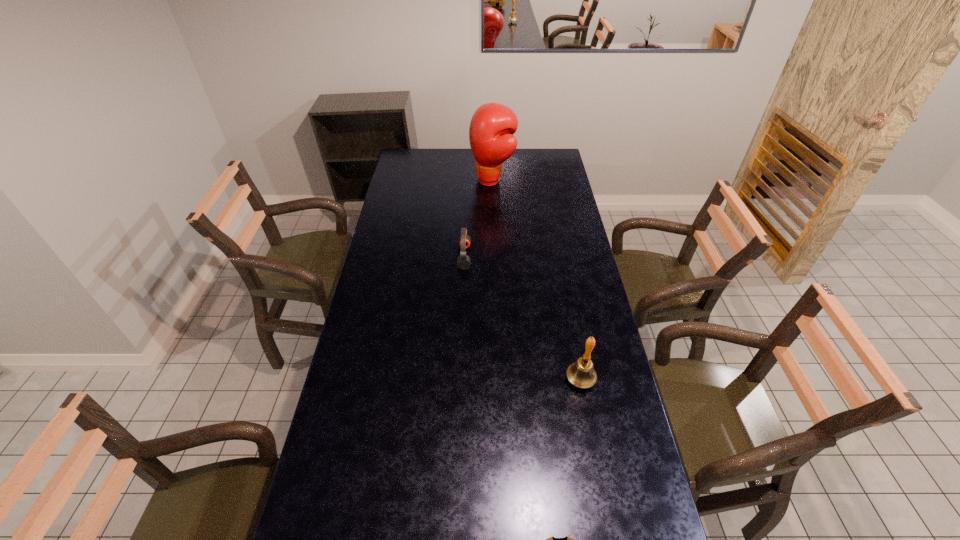
The height and width of the screenshot is (540, 960). I want to click on free space located on the ear cups of the earphone, so click(553, 257).

You are a GUI agent. You are given a task and a screenshot of the screen. Output one action in this format:
    pyautogui.click(x=<x>, y=<y>)
    Task: Click on the object located in the far edge section of the desktop
    This screenshot has width=960, height=540.
    Given the screenshot: What is the action you would take?
    pyautogui.click(x=492, y=126)

What are the coordinates of `object situated at the right edge` in the screenshot? It's located at (581, 374).

Where is `free space at the far edge of the desktop`? This screenshot has width=960, height=540. free space at the far edge of the desktop is located at coordinates (507, 164).

Find the location of a particular element. vacant space at the left edge of the desktop is located at coordinates (406, 215).

Find the location of a particular element. The height and width of the screenshot is (540, 960). vacant area at the right edge of the desktop is located at coordinates pos(636,494).

What are the coordinates of `vacant position at the far left corner of the desktop` in the screenshot? It's located at coord(417,164).

In order to click on free area in between the boxing glove and the earphone in this screenshot , I will do `click(478, 219)`.

At what (x,y) coordinates should I click in order to perform the action: click on vacant space that's between the tallest object and the second tallest object. Please return your answer as a coordinate pair (x, y). This screenshot has height=540, width=960. Looking at the image, I should click on (537, 280).

Identify the location of free spot between the tallest object and the third tallest object. (x=478, y=219).